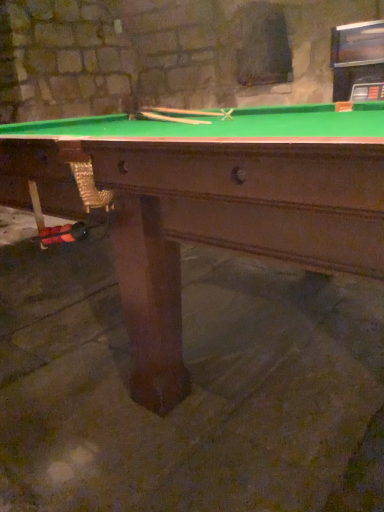
Question: Can you confirm if green felt pool table at center is positioned to the left of wooden cue at center, which ranks as the 2th cue in top-to-bottom order?

Choices:
 (A) yes
 (B) no

Answer: (B)

Question: Is green felt pool table at center placed right next to wooden cue at center, the first cue when ordered from bottom to top?

Choices:
 (A) yes
 (B) no

Answer: (B)

Question: Can you confirm if green felt pool table at center is bigger than wooden cue at center, the first cue when ordered from bottom to top?

Choices:
 (A) yes
 (B) no

Answer: (A)

Question: Is wooden cue at center, the first cue when ordered from bottom to top, a part of green felt pool table at center?

Choices:
 (A) no
 (B) yes

Answer: (B)

Question: From a real-world perspective, is green felt pool table at center located beneath wooden cue at center, the first cue when ordered from bottom to top?

Choices:
 (A) yes
 (B) no

Answer: (A)

Question: From the image's perspective, is green felt pool table at center positioned above or below wooden cue at center, the first cue when ordered from bottom to top?

Choices:
 (A) below
 (B) above

Answer: (A)

Question: From a real-world perspective, is green felt pool table at center positioned above or below wooden cue at center, the first cue when ordered from bottom to top?

Choices:
 (A) below
 (B) above

Answer: (A)

Question: Would you say green felt pool table at center is inside or outside wooden cue at center, the first cue when ordered from bottom to top?

Choices:
 (A) inside
 (B) outside

Answer: (B)

Question: Looking at their shapes, would you say green felt pool table at center is wider or thinner than wooden cue at center, the first cue when ordered from bottom to top?

Choices:
 (A) thin
 (B) wide

Answer: (B)

Question: Relative to green felt pool table at center, is wooden cue at center, the second cue ordered from the bottom, in front or behind?

Choices:
 (A) behind
 (B) front

Answer: (A)

Question: Is wooden cue at center, the second cue ordered from the bottom, to the left or to the right of green felt pool table at center in the image?

Choices:
 (A) left
 (B) right

Answer: (A)

Question: Choose the correct answer: Is wooden cue at center, the second cue ordered from the bottom, inside green felt pool table at center or outside it?

Choices:
 (A) outside
 (B) inside

Answer: (B)

Question: Considering the positions of wooden cue at center, the first cue in the top-to-bottom sequence, and green felt pool table at center in the image, is wooden cue at center, the first cue in the top-to-bottom sequence, taller or shorter than green felt pool table at center?

Choices:
 (A) tall
 (B) short

Answer: (B)

Question: Does point (190, 119) appear closer or farther from the camera than point (129, 151)?

Choices:
 (A) farther
 (B) closer

Answer: (A)

Question: In terms of height, does wooden cue at center, which ranks as the 2th cue in top-to-bottom order, look taller or shorter compared to green felt pool table at center?

Choices:
 (A) tall
 (B) short

Answer: (B)